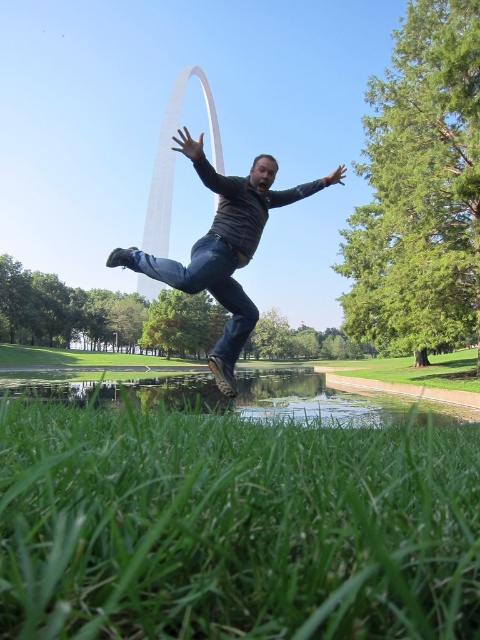
Question: Where is jeans at center located in relation to denim at center in the image?

Choices:
 (A) below
 (B) above

Answer: (B)

Question: Which object is the closest to the matte black arm at center?

Choices:
 (A) jeans at center
 (B) green grass at lower center

Answer: (A)

Question: Which object is positioned farthest from the matte black arm at center?

Choices:
 (A) denim at center
 (B) green grass at lower center

Answer: (B)

Question: Can you confirm if jeans at center is thinner than denim at center?

Choices:
 (A) no
 (B) yes

Answer: (A)

Question: Does jeans at center come in front of matte black arm at upper center?

Choices:
 (A) no
 (B) yes

Answer: (B)

Question: Estimate the real-world distances between objects in this image. Which object is farther from the matte black arm at upper center?

Choices:
 (A) denim at center
 (B) green grass at lower center
 (C) matte black arm at center
 (D) jeans at center

Answer: (B)